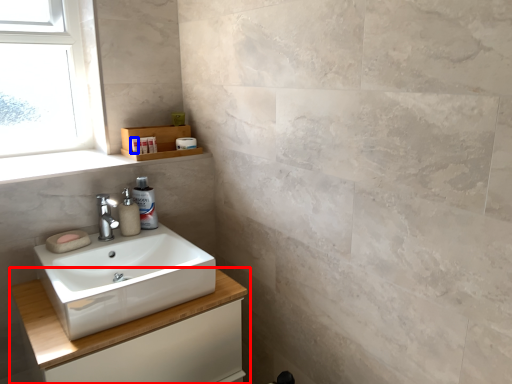
Question: Which of the following is the farthest to the observer, bathroom cabinet (highlighted by a red box) or toiletry (highlighted by a blue box)?

Choices:
 (A) bathroom cabinet
 (B) toiletry

Answer: (B)